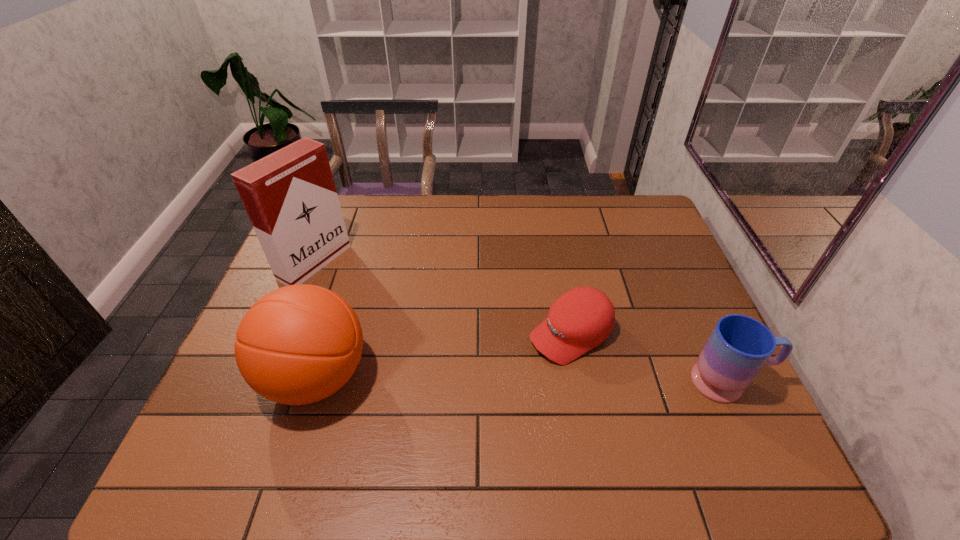
Identify the location of free spot located on the front-facing side of the shortest object. The height and width of the screenshot is (540, 960). (418, 424).

The width and height of the screenshot is (960, 540). What are the coordinates of `free space located on the front-facing side of the tallest object` in the screenshot? It's located at (375, 298).

Find the location of a particular element. This screenshot has height=540, width=960. vacant space situated 0.200m on the front-facing side of the tallest object is located at coordinates (386, 303).

The width and height of the screenshot is (960, 540). Find the location of `free spot located 0.160m on the front-facing side of the tallest object`. free spot located 0.160m on the front-facing side of the tallest object is located at coordinates (375, 298).

Image resolution: width=960 pixels, height=540 pixels. Identify the location of basketball that is at the near edge. (298, 344).

Locate an element on the screen. mug that is at the near edge is located at coordinates (739, 346).

Image resolution: width=960 pixels, height=540 pixels. I want to click on basketball present at the left edge, so click(x=298, y=344).

You are a GUI agent. You are given a task and a screenshot of the screen. Output one action in this format:
    pyautogui.click(x=<x>, y=<y>)
    Task: Click on the cigarette_case present at the left edge
    The width and height of the screenshot is (960, 540).
    Given the screenshot: What is the action you would take?
    (x=290, y=197)

You are a GUI agent. You are given a task and a screenshot of the screen. Output one action in this format:
    pyautogui.click(x=<x>, y=<y>)
    Task: Click on the object that is positioned at the right edge
    
    Given the screenshot: What is the action you would take?
    pyautogui.click(x=739, y=346)

The height and width of the screenshot is (540, 960). In order to click on object at the near left corner in this screenshot , I will do `click(298, 344)`.